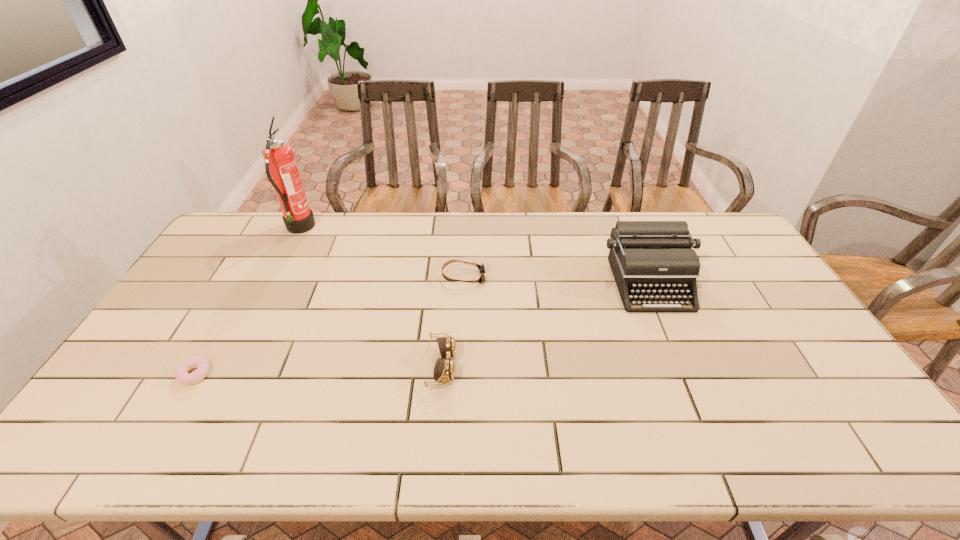
Identify which object is located as the nearest to the shorter goggles. Please provide its 2D coordinates. Your answer should be formatted as a tuple, i.e. [(x, y)], where the tuple contains the x and y coordinates of a point satisfying the conditions above.

[(444, 369)]

Where is `free location that satisfies the following two spatial constraints: 1. on the typing side of the rightmost object; 2. through the lenses of the nearer goggles`? This screenshot has height=540, width=960. free location that satisfies the following two spatial constraints: 1. on the typing side of the rightmost object; 2. through the lenses of the nearer goggles is located at coordinates (684, 366).

In order to click on vacant position in the image that satisfies the following two spatial constraints: 1. on the typing side of the typewriter; 2. through the lenses of the taller goggles in this screenshot , I will do `click(684, 366)`.

Locate an element on the screen. vacant space that satisfies the following two spatial constraints: 1. on the typing side of the typewriter; 2. through the lenses of the third shortest object is located at coordinates (684, 366).